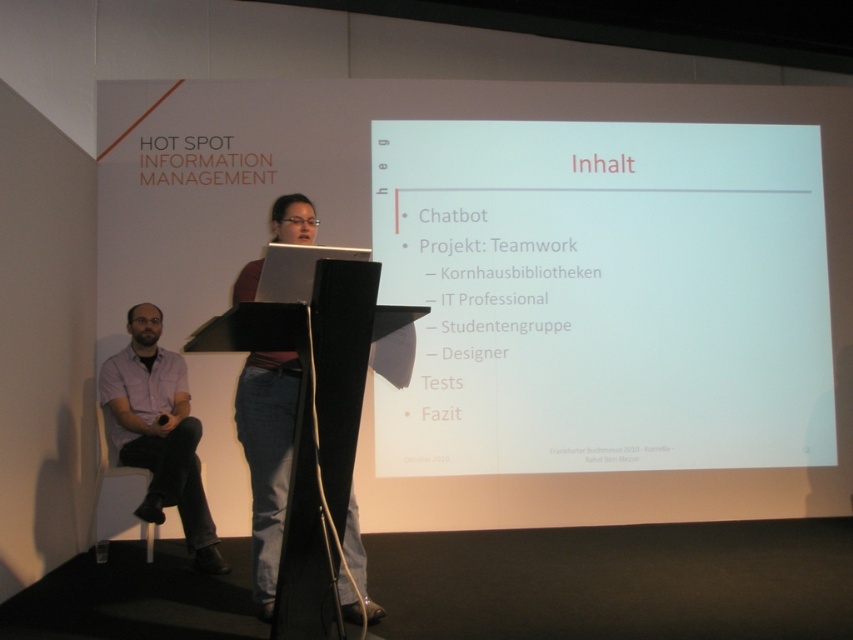
Question: Observing the image, what is the correct spatial positioning of white matte projector screen at center in reference to purple shirt at left?

Choices:
 (A) right
 (B) left

Answer: (A)

Question: Which object appears farthest from the camera in this image?

Choices:
 (A) purple shirt at left
 (B) white matte projector screen at center

Answer: (B)

Question: Does white matte projector screen at center appear on the left side of purple shirt at left?

Choices:
 (A) yes
 (B) no

Answer: (B)

Question: Which object is farther from the camera taking this photo?

Choices:
 (A) white matte projector screen at center
 (B) purple shirt at left

Answer: (A)

Question: Does white matte projector screen at center have a lesser width compared to purple shirt at left?

Choices:
 (A) yes
 (B) no

Answer: (B)

Question: Which point is farther to the camera?

Choices:
 (A) (163, 404)
 (B) (546, 292)

Answer: (B)